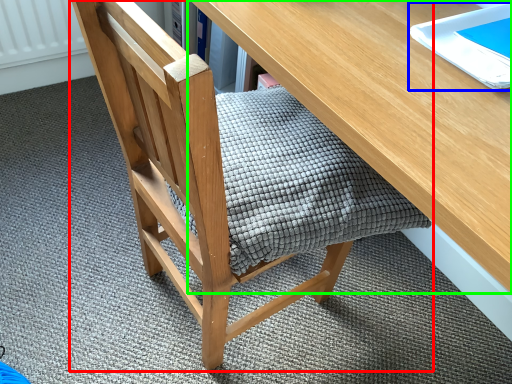
Question: Based on their relative distances, which object is farther from chair (highlighted by a red box)? Choose from notebook (highlighted by a blue box) and desk (highlighted by a green box).

Choices:
 (A) notebook
 (B) desk

Answer: (A)